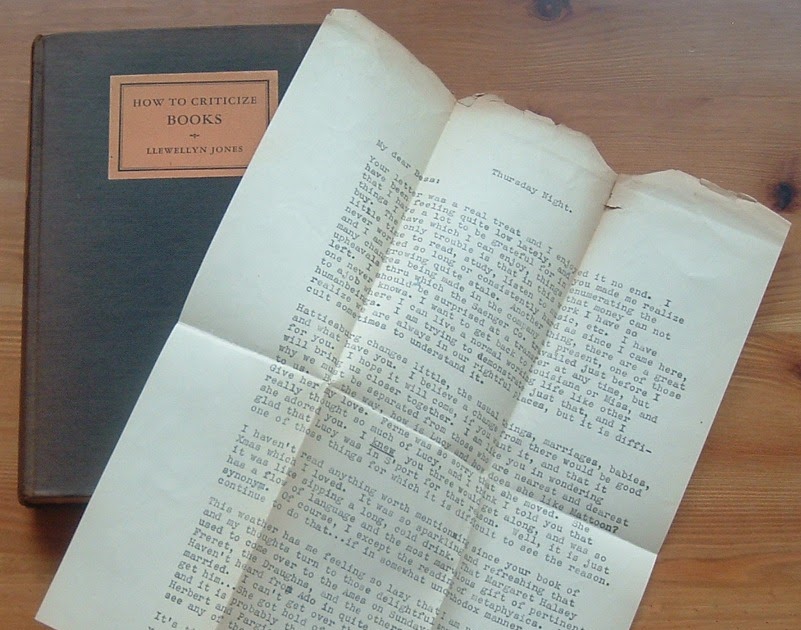
Find the location of `wooden table`. wooden table is located at coordinates (739, 447).